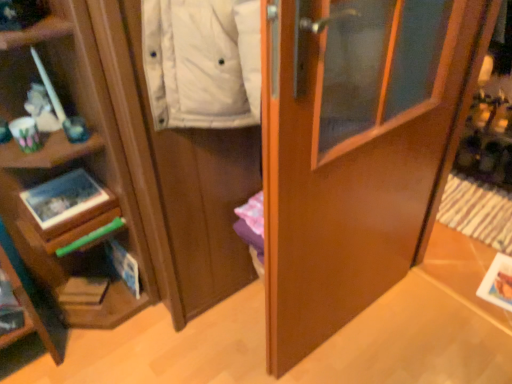
Question: Looking at their shapes, would you say matte wood cabinet at left is wider or thinner than matte cardboard magazine at lower left?

Choices:
 (A) thin
 (B) wide

Answer: (B)

Question: Looking at the image, does matte wood cabinet at left seem bigger or smaller compared to matte cardboard magazine at lower left?

Choices:
 (A) small
 (B) big

Answer: (B)

Question: Which object is the farthest from the matte wood cabinet at left?

Choices:
 (A) glossy wood door at center
 (B) matte cardboard magazine at lower left

Answer: (B)

Question: Which object is positioned farthest from the glossy wood door at center?

Choices:
 (A) matte wood cabinet at left
 (B) matte cardboard magazine at lower left

Answer: (B)